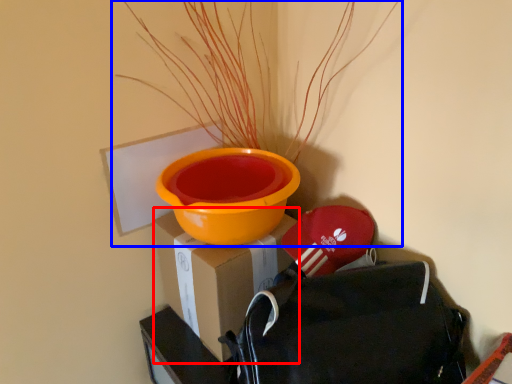
Question: Among these objects, which one is farthest to the camera, cardboard box (highlighted by a red box) or houseplant (highlighted by a blue box)?

Choices:
 (A) cardboard box
 (B) houseplant

Answer: (A)